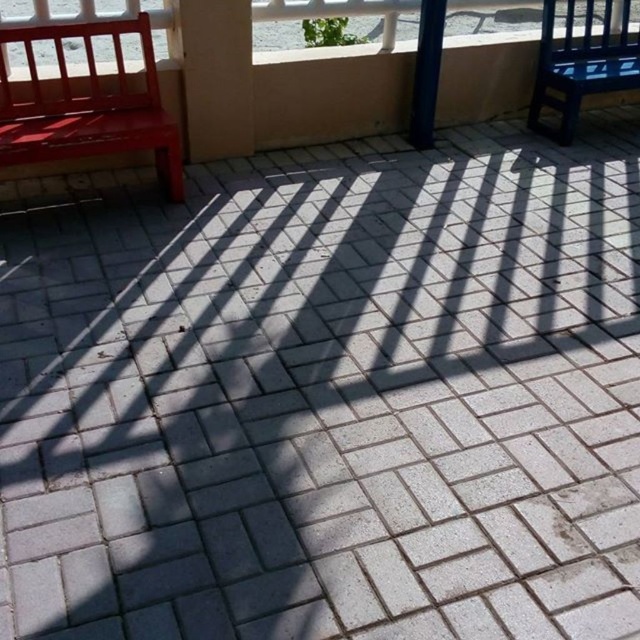
You are a guest at a patio and want to sit as far left as possible. Which object should you choose between the matte red bench at left and the blue glossy chair at right?

The matte red bench at left is positioned on the left side of the blue glossy chair at right, so you should choose the matte red bench at left to sit as far left as possible.

You are planning to place a large rectangular plant pot between the matte red bench at left and the blue glossy chair at right. Given their widths, which object should the pot be closer to to ensure it doesn

The matte red bench at left is wider than the blue glossy chair at right. To accommodate the large rectangular plant pot, it should be placed closer to the matte red bench at left since it has more space available due to its greater width.